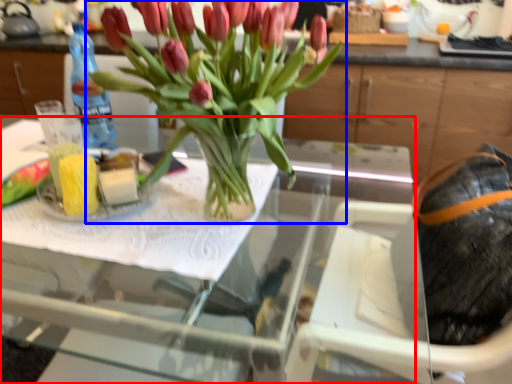
Question: Which object appears farthest to the camera in this image, table (highlighted by a red box) or houseplant (highlighted by a blue box)?

Choices:
 (A) table
 (B) houseplant

Answer: (B)